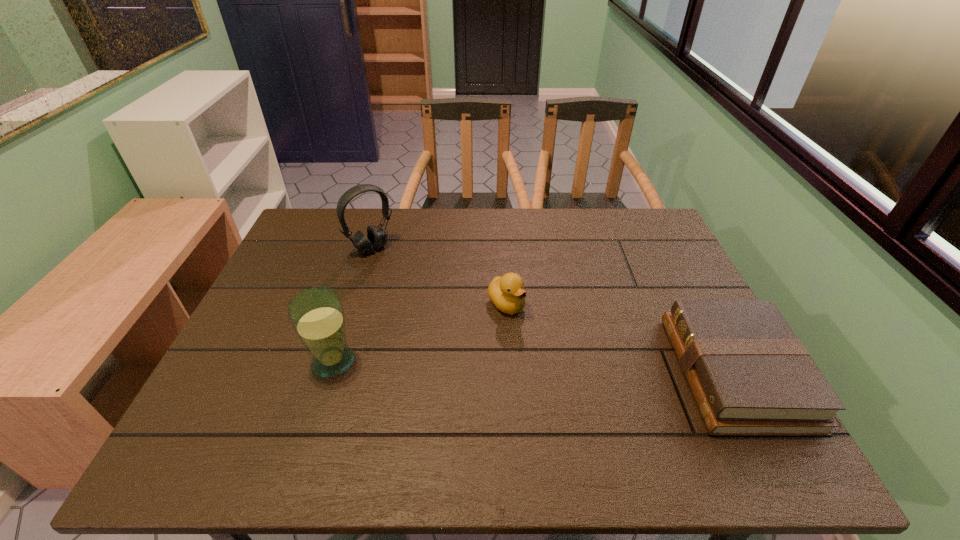
Locate an element on the screen. The image size is (960, 540). vacant space that satisfies the following two spatial constraints: 1. on the front side of the glass; 2. on the spine side of the shortest object is located at coordinates (329, 373).

This screenshot has height=540, width=960. I want to click on vacant position in the image that satisfies the following two spatial constraints: 1. on the front side of the headset; 2. on the left side of the third tallest object, so click(354, 304).